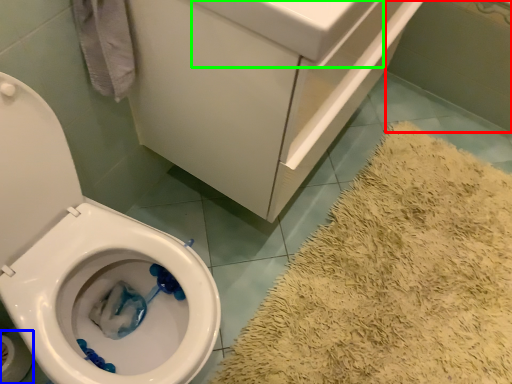
Question: Which object is positioned closest to bath (highlighted by a red box)? Select from toilet paper (highlighted by a blue box) and sink (highlighted by a green box).

Choices:
 (A) toilet paper
 (B) sink

Answer: (B)